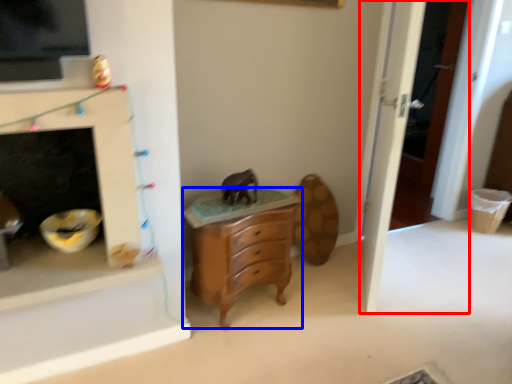
Question: Among these objects, which one is farthest to the camera, door (highlighted by a red box) or chest of drawers (highlighted by a blue box)?

Choices:
 (A) door
 (B) chest of drawers

Answer: (B)